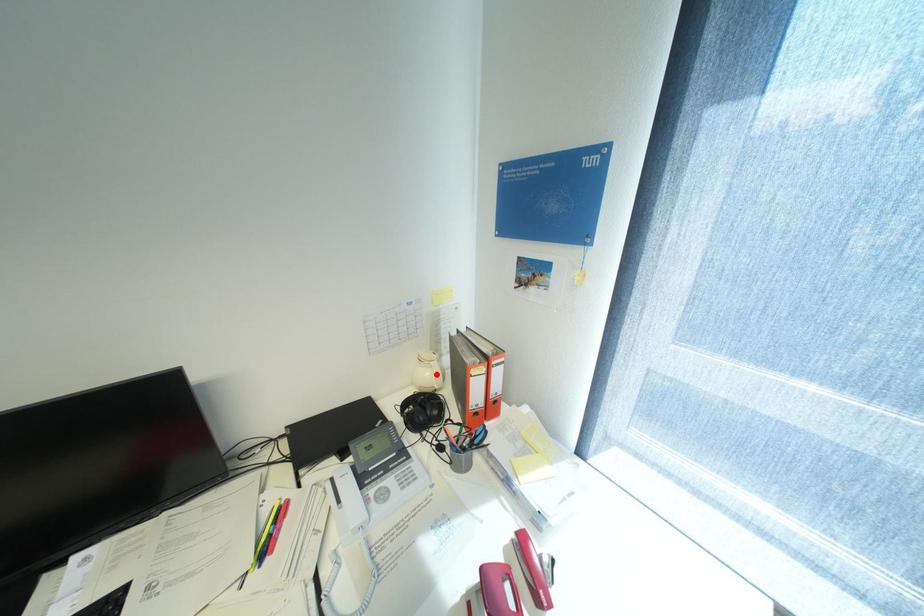
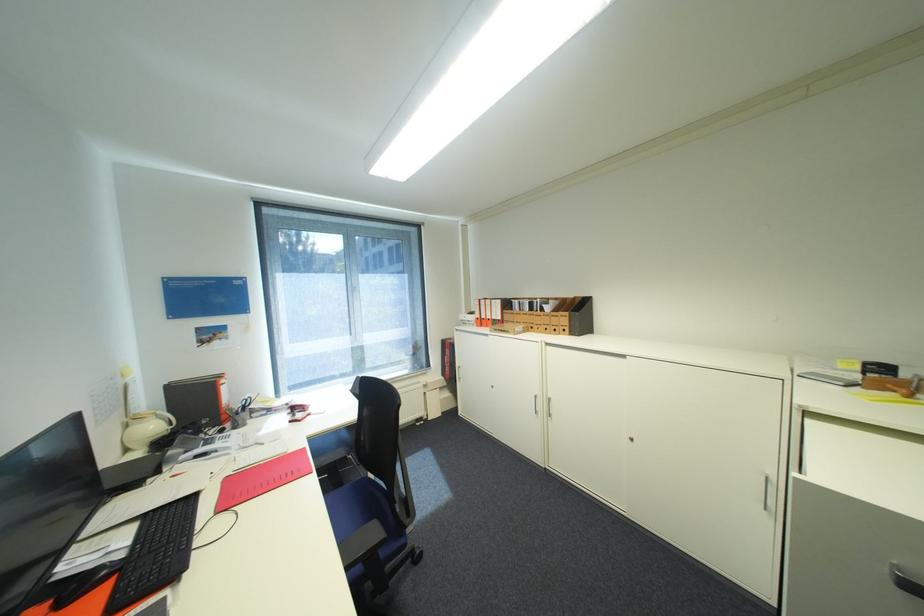
The point at the highlighted location is marked in the first image. Where is the corresponding point in the second image?

(161, 427)